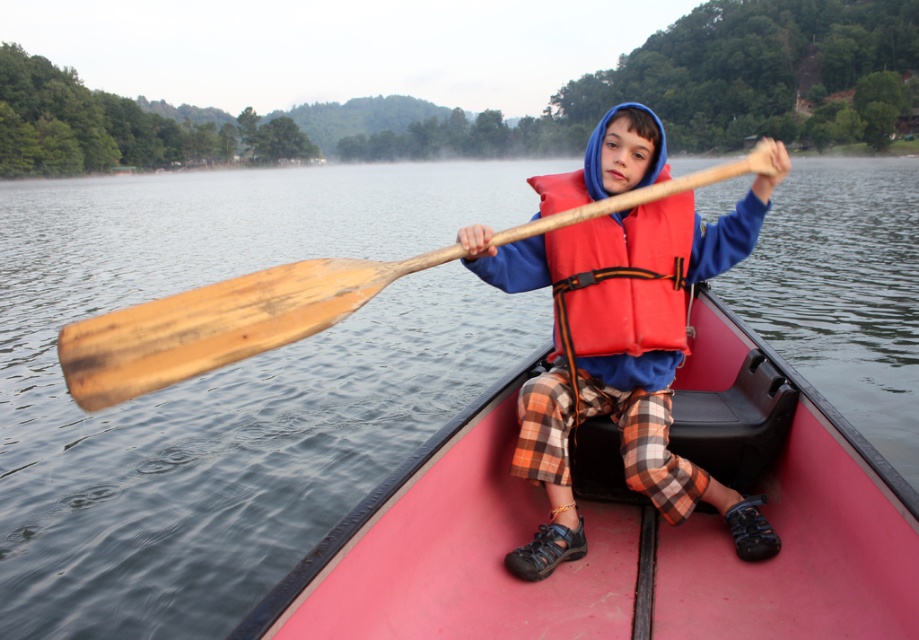
Question: From the image, what is the correct spatial relationship of wooden paddle at center in relation to red life jacket at center?

Choices:
 (A) left
 (B) right

Answer: (A)

Question: Is matte orange life vest at center smaller than red life jacket at center?

Choices:
 (A) no
 (B) yes

Answer: (A)

Question: Among these objects, which one is nearest to the camera?

Choices:
 (A) matte orange life vest at center
 (B) red life jacket at center
 (C) wooden paddle at center

Answer: (C)

Question: Considering the real-world distances, which object is closest to the matte orange life vest at center?

Choices:
 (A) red life jacket at center
 (B) wooden paddle at center

Answer: (A)

Question: Estimate the real-world distances between objects in this image. Which object is farther from the wooden paddle at center?

Choices:
 (A) matte orange life vest at center
 (B) red life jacket at center

Answer: (A)

Question: Can you confirm if matte orange life vest at center is wider than red life jacket at center?

Choices:
 (A) no
 (B) yes

Answer: (B)